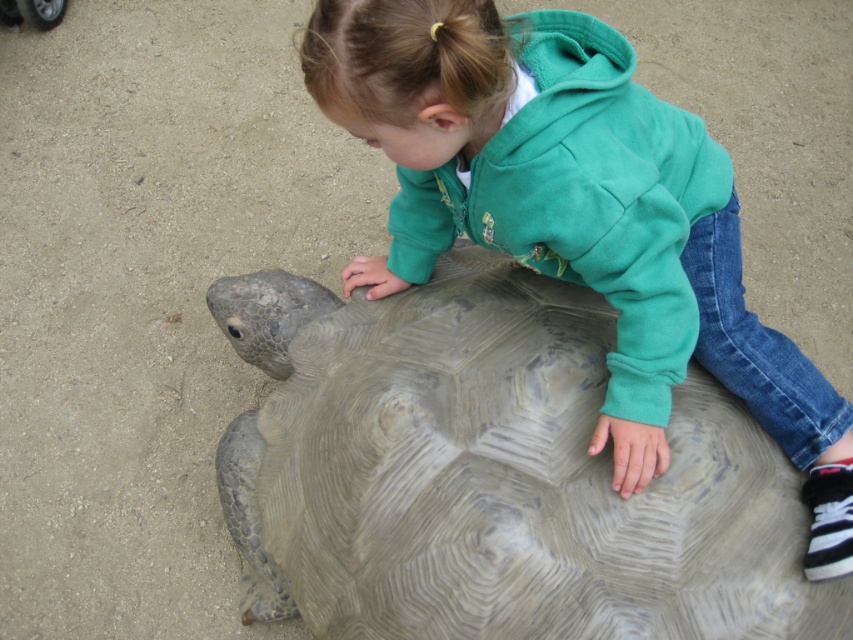
Question: Does gray textured shell at center come behind green fleece jacket at upper center?

Choices:
 (A) yes
 (B) no

Answer: (A)

Question: Which of the following is the closest to the observer?

Choices:
 (A) gray textured shell at center
 (B) green fleece jacket at upper center

Answer: (B)

Question: Which point is farther from the camera taking this photo?

Choices:
 (A) (585, 140)
 (B) (427, 323)

Answer: (B)

Question: In this image, where is gray textured shell at center located relative to green fleece jacket at upper center?

Choices:
 (A) left
 (B) right

Answer: (A)

Question: Which point is farther to the camera?

Choices:
 (A) green fleece jacket at upper center
 (B) gray textured shell at center

Answer: (B)

Question: Considering the relative positions of gray textured shell at center and green fleece jacket at upper center in the image provided, where is gray textured shell at center located with respect to green fleece jacket at upper center?

Choices:
 (A) below
 (B) above

Answer: (A)